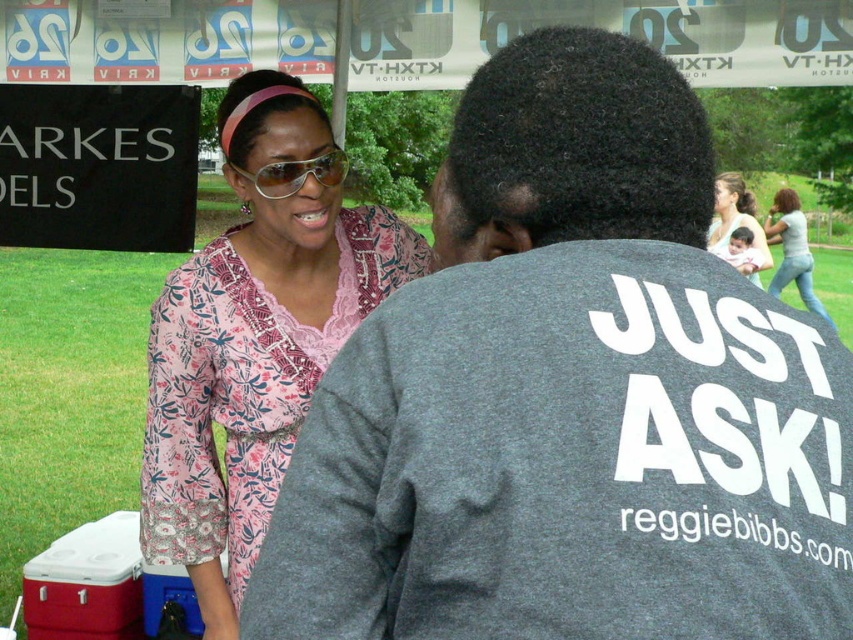
Does floral fabric dress at upper left appear on the left side of sunglasses at center?

No, floral fabric dress at upper left is not to the left of sunglasses at center.

Is floral fabric dress at upper left smaller than sunglasses at center?

Actually, floral fabric dress at upper left might be larger than sunglasses at center.

Between point (213, 630) and point (288, 193), which one is positioned in front?

Point (288, 193)

You are a GUI agent. You are given a task and a screenshot of the screen. Output one action in this format:
    pyautogui.click(x=<x>, y=<y>)
    Task: Click on the floral fabric dress at upper left
    
    Given the screenshot: What is the action you would take?
    pyautogui.click(x=254, y=340)

Who is positioned more to the left, gray cotton t-shirt at center or floral fabric dress at upper left?

floral fabric dress at upper left

Who is taller, gray cotton t-shirt at center or floral fabric dress at upper left?

floral fabric dress at upper left is taller.

I want to click on gray cotton t-shirt at center, so click(570, 397).

Does jeans at center have a greater height compared to sunglasses at center?

Yes, jeans at center is taller than sunglasses at center.

Is point (775, 230) closer to camera compared to point (296, 177)?

No, it is not.

This screenshot has width=853, height=640. Find the location of `jeans at center`. jeans at center is located at coordinates (791, 250).